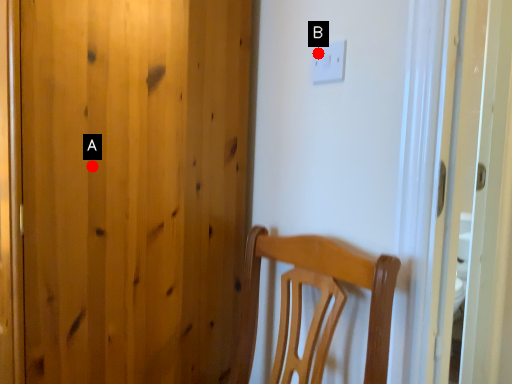
Question: Two points are circled on the image, labeled by A and B beside each circle. Which point is closer to the camera?

Choices:
 (A) A is closer
 (B) B is closer

Answer: (A)